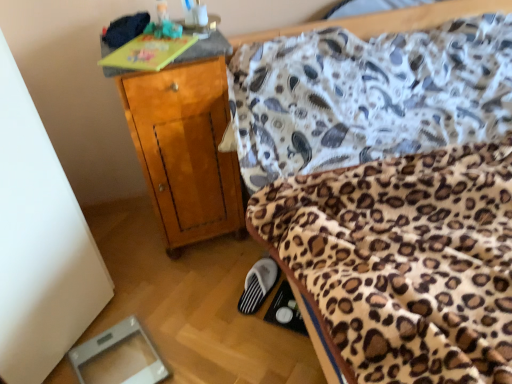
Where is `free space behind black suede slipper at lower center`? Image resolution: width=512 pixels, height=384 pixels. free space behind black suede slipper at lower center is located at coordinates (239, 263).